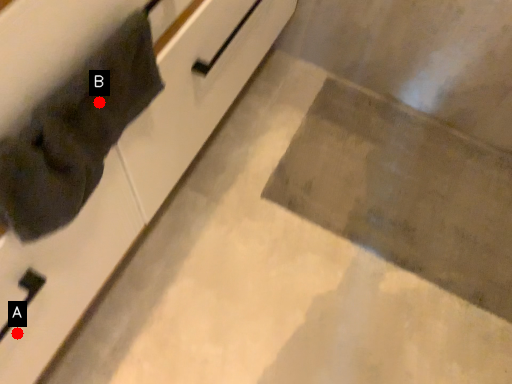
Question: Two points are circled on the image, labeled by A and B beside each circle. Which point is closer to the camera?

Choices:
 (A) A is closer
 (B) B is closer

Answer: (B)